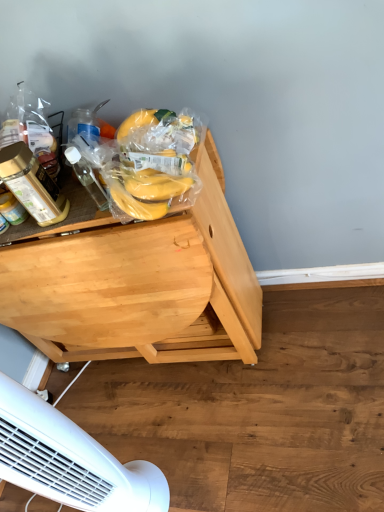
Identify the location of vacant space situated on the left part of transparent plastic bottle at left, which is counted as the 1th bottle, starting from the right. tap(72, 217).